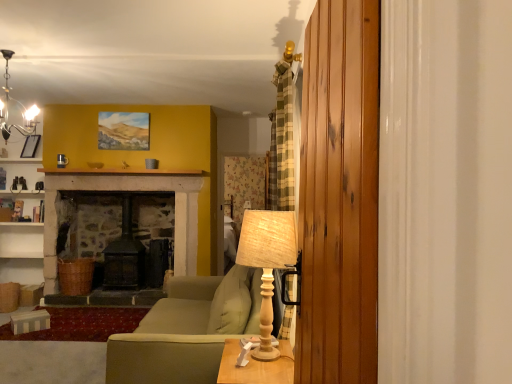
Where is `matte black picture frame at upper left`? matte black picture frame at upper left is located at coordinates (30, 146).

This screenshot has width=512, height=384. What do you see at coordinates (30, 146) in the screenshot? I see `matte black picture frame at upper left` at bounding box center [30, 146].

What do you see at coordinates (267, 262) in the screenshot? The height and width of the screenshot is (384, 512). I see `wooden table lamp at center` at bounding box center [267, 262].

This screenshot has width=512, height=384. What are the coordinates of `wooden barn door at right` in the screenshot? It's located at (339, 195).

Where is `green fabric couch at center`? The height and width of the screenshot is (384, 512). green fabric couch at center is located at coordinates (187, 330).

Can you tell me how much wooden table lamp at center and matte black chandelier at upper left differ in facing direction?

wooden table lamp at center and matte black chandelier at upper left are facing 86.3 degrees away from each other.

Who is shorter, wooden table lamp at center or matte black chandelier at upper left?

matte black chandelier at upper left is shorter.

Considering the positions of points (268, 274) and (23, 106), is point (268, 274) farther from camera compared to point (23, 106)?

No.

Measure the distance from wooden table lamp at center to matte black chandelier at upper left.

They are 14.15 feet apart.

Considering the points (274, 257) and (324, 336), which point is in front, point (274, 257) or point (324, 336)?

The point (324, 336) is closer.

Which is more to the left, wooden table lamp at center or wooden barn door at right?

wooden table lamp at center.

From the image's perspective, is wooden table lamp at center above wooden barn door at right?

No.

Is wooden table lamp at center smaller than wooden barn door at right?

Yes, wooden table lamp at center is smaller than wooden barn door at right.

Could wooden table at lower center be considered to be inside matte black chandelier at upper left?

No, wooden table at lower center is located outside of matte black chandelier at upper left.

Is point (26, 127) more distant than point (238, 349)?

Yes, point (26, 127) is farther from viewer.

Is matte black chandelier at upper left oriented towards wooden table at lower center?

No, matte black chandelier at upper left is not turned towards wooden table at lower center.

From a real-world perspective, is matte black chandelier at upper left on wooden table at lower center?

Yes.

From the image's perspective, is matte black chandelier at upper left positioned above or below matte black picture frame at upper left?

From the image's perspective, matte black chandelier at upper left appears above matte black picture frame at upper left.

From a real-world perspective, does matte black chandelier at upper left stand above matte black picture frame at upper left?

Indeed, from a real-world perspective, matte black chandelier at upper left stands above matte black picture frame at upper left.

Is matte black chandelier at upper left positioned in front of matte black picture frame at upper left?

Yes, it is.

From the image's perspective, which is above, wooden table at lower center or wooden barn door at right?

wooden barn door at right appears higher in the image.

Considering the relative positions of wooden table at lower center and wooden barn door at right in the image provided, is wooden table at lower center in front of wooden barn door at right?

No, the depth of wooden table at lower center is greater than that of wooden barn door at right.

From a real-world perspective, which object stands above the other?

In real-world perspective, wooden barn door at right is above.

Would you say wooden table at lower center is inside or outside wooden barn door at right?

wooden table at lower center lies outside wooden barn door at right.

Could you tell me if green fabric couch at center is turned towards matte black picture frame at upper left?

No, green fabric couch at center is not aimed at matte black picture frame at upper left.

Which is further, (158, 376) or (25, 141)?

Positioned behind is point (25, 141).

Can we say green fabric couch at center lies outside matte black picture frame at upper left?

Yes.

At what (x,y) coordinates should I click in order to perform the action: click on picture frame above the green fabric couch at center (from the image's perspective). Please return your answer as a coordinate pair (x, y). The height and width of the screenshot is (384, 512). Looking at the image, I should click on (30, 146).

Between wooden barn door at right and matte black chandelier at upper left, which one has smaller width?

wooden barn door at right.

Would you say wooden barn door at right is a long distance from matte black chandelier at upper left?

Yes, wooden barn door at right and matte black chandelier at upper left are quite far apart.

Is wooden barn door at right facing towards matte black chandelier at upper left?

No, wooden barn door at right is not oriented towards matte black chandelier at upper left.

From a real-world perspective, relative to matte black chandelier at upper left, is wooden barn door at right vertically above or below?

In terms of real-world spatial position, wooden barn door at right is below matte black chandelier at upper left.

At what (x,y) coordinates should I click in order to perform the action: click on table lamp below the matte black chandelier at upper left (from the image's perspective). Please return your answer as a coordinate pair (x, y). Looking at the image, I should click on (267, 262).

Locate an element on the screen. table lamp located behind the wooden barn door at right is located at coordinates (267, 262).

Estimate the real-world distances between objects in this image. Which object is further from wooden table at lower center, matte black chandelier at upper left or wooden table lamp at center?

Among the two, matte black chandelier at upper left is located further to wooden table at lower center.

Looking at this image, looking at the image, which one is located further to wooden table at lower center, wooden barn door at right or matte black picture frame at upper left?

matte black picture frame at upper left lies further to wooden table at lower center than the other object.

Estimate the real-world distances between objects in this image. Which object is closer to matte black chandelier at upper left, green fabric couch at center or wooden table lamp at center?

green fabric couch at center lies closer to matte black chandelier at upper left than the other object.

Looking at the image, which one is located further to wooden table lamp at center, matte black chandelier at upper left or green fabric couch at center?

Based on the image, matte black chandelier at upper left appears to be further to wooden table lamp at center.

Estimate the real-world distances between objects in this image. Which object is closer to green fabric couch at center, wooden table lamp at center or matte black chandelier at upper left?

The object closer to green fabric couch at center is wooden table lamp at center.

Estimate the real-world distances between objects in this image. Which object is closer to wooden table at lower center, matte black chandelier at upper left or green fabric couch at center?

green fabric couch at center lies closer to wooden table at lower center than the other object.

Based on their spatial positions, is wooden table lamp at center or wooden barn door at right further from matte black chandelier at upper left?

Based on the image, wooden barn door at right appears to be further to matte black chandelier at upper left.

From the image, which object appears to be nearer to green fabric couch at center, matte black picture frame at upper left or wooden barn door at right?

Among the two, wooden barn door at right is located nearer to green fabric couch at center.

The width and height of the screenshot is (512, 384). Identify the location of studio couch located between wooden table lamp at center and matte black picture frame at upper left in the depth direction. click(x=187, y=330).

The width and height of the screenshot is (512, 384). I want to click on studio couch situated between matte black chandelier at upper left and wooden table lamp at center from left to right, so click(187, 330).

I want to click on table lamp between matte black chandelier at upper left and wooden barn door at right from left to right, so click(x=267, y=262).

Locate an element on the screen. The width and height of the screenshot is (512, 384). studio couch located between wooden barn door at right and matte black chandelier at upper left in the depth direction is located at coordinates (187, 330).